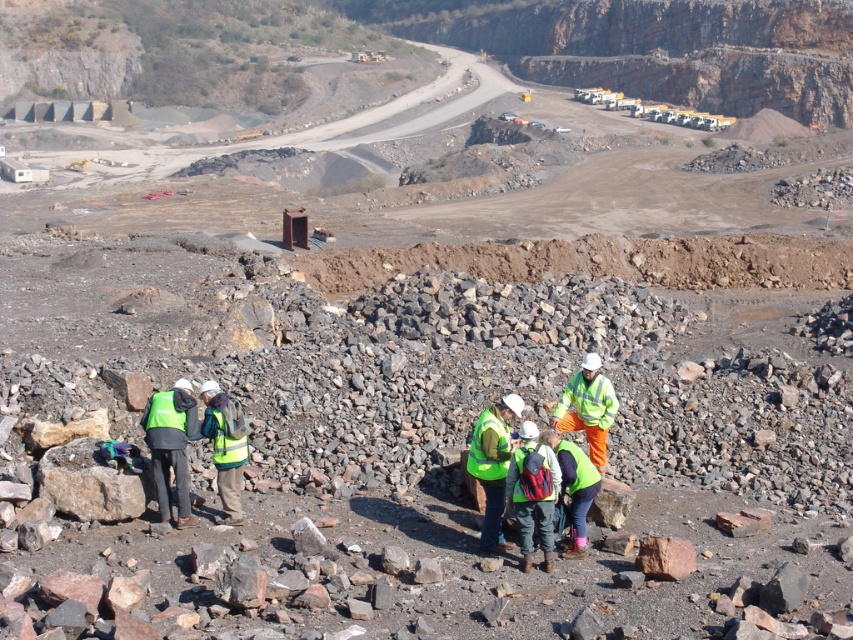
You are a safety inspector at the quarry and need to ensure all workers are wearing the correct safety gear. According to the image, which safety vest is more appropriate for visibility purposes, the high visibility fabric safety vest at center or the green matte safety vest at lower left?

The high visibility fabric safety vest at center is larger in size than the green matte safety vest at lower left, making it more appropriate for visibility purposes as its increased size enhances visibility in the quarry environment.

You are a drone operator tasked with capturing aerial footage of the quarry site. You need to position your drone to focus on the green matte safety vest at center. What are the coordinates where you should direct the drone to hover?

The coordinates for the green matte safety vest at center are at point (531, 474), so you should direct the drone to hover there.